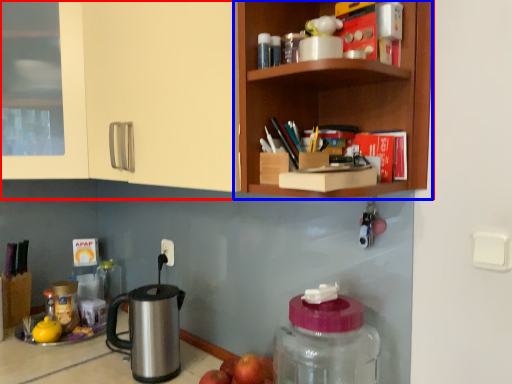
Question: Which point is further to the camera, cabinetry (highlighted by a red box) or shelf (highlighted by a blue box)?

Choices:
 (A) cabinetry
 (B) shelf

Answer: (B)